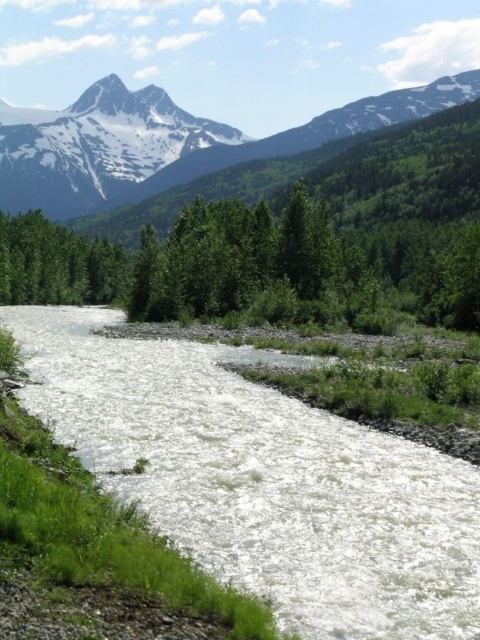
Who is positioned more to the right, snowy granite mountain at upper center or snowy granite mountain at upper left?

snowy granite mountain at upper center

Does snowy granite mountain at upper center have a greater height compared to snowy granite mountain at upper left?

Incorrect, snowy granite mountain at upper center's height is not larger of snowy granite mountain at upper left's.

Where is `snowy granite mountain at upper center`? This screenshot has height=640, width=480. snowy granite mountain at upper center is located at coordinates (192, 152).

Identify the location of snowy granite mountain at upper center. (192, 152).

In the scene shown: Does white frothy water at center appear under snowy granite mountain at upper left?

Indeed, white frothy water at center is positioned under snowy granite mountain at upper left.

Is white frothy water at center shorter than snowy granite mountain at upper left?

Yes.

Between point (255, 516) and point (12, 209), which one is positioned in front?

Point (255, 516) is in front.

Identify the location of white frothy water at center. (264, 480).

Does white frothy water at center appear under snowy granite mountain at upper center?

Indeed, white frothy water at center is positioned under snowy granite mountain at upper center.

Does white frothy water at center have a smaller size compared to snowy granite mountain at upper center?

Yes.

At what (x,y) coordinates should I click in order to perform the action: click on white frothy water at center. Please return your answer as a coordinate pair (x, y). This screenshot has width=480, height=640. Looking at the image, I should click on (264, 480).